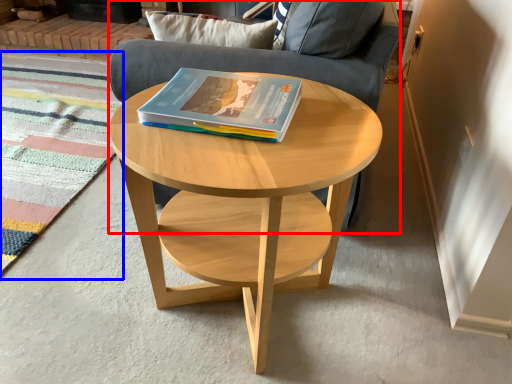
Question: Which of the following is the farthest to the observer, armchair (highlighted by a red box) or mat (highlighted by a blue box)?

Choices:
 (A) armchair
 (B) mat

Answer: (B)